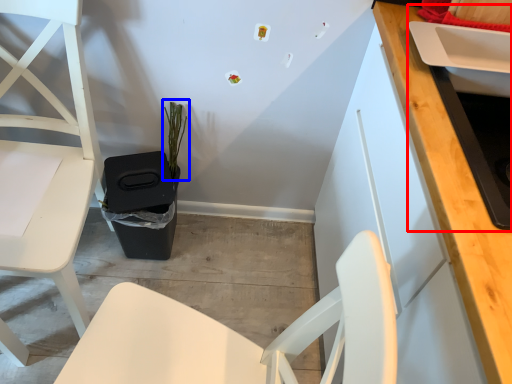
Question: Among these objects, which one is nearest to the camera, sink (highlighted by a red box) or plant (highlighted by a blue box)?

Choices:
 (A) sink
 (B) plant

Answer: (A)